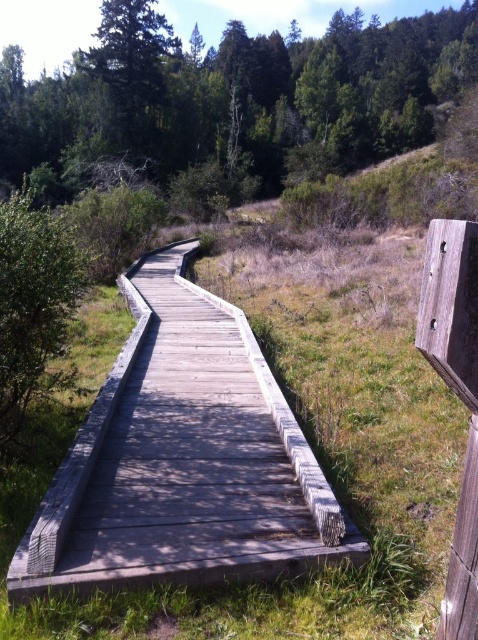
Between gray wooden boardwalk at center and green leafy bush at left, which one has less height?

With less height is gray wooden boardwalk at center.

Looking at this image, does gray wooden boardwalk at center appear on the right side of green leafy bush at left?

Correct, you'll find gray wooden boardwalk at center to the right of green leafy bush at left.

What do you see at coordinates (183, 460) in the screenshot? This screenshot has width=478, height=640. I see `gray wooden boardwalk at center` at bounding box center [183, 460].

This screenshot has height=640, width=478. In order to click on gray wooden boardwalk at center in this screenshot , I will do `click(183, 460)`.

Does gray wooden boardwalk at center have a larger size compared to green leafy tree at upper center?

Incorrect, gray wooden boardwalk at center is not larger than green leafy tree at upper center.

Is gray wooden boardwalk at center above green leafy tree at upper center?

No.

Where is `gray wooden boardwalk at center`? The image size is (478, 640). gray wooden boardwalk at center is located at coordinates click(x=183, y=460).

Between green leafy tree at upper center and green leafy bush at left, which one appears on the left side from the viewer's perspective?

green leafy bush at left

Who is lower down, green leafy tree at upper center or green leafy bush at left?

Positioned lower is green leafy bush at left.

Is point (400, 45) more distant than point (3, 298)?

Yes, it is.

Locate an element on the screen. Image resolution: width=478 pixels, height=640 pixels. green leafy tree at upper center is located at coordinates (234, 99).